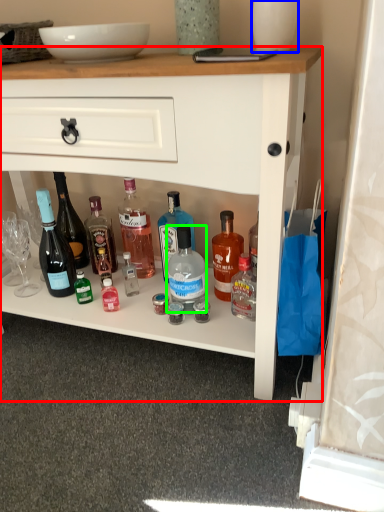
Question: Considering the real-world distances, which object is farthest from desk (highlighted by a red box)? glass vase (highlighted by a blue box) or bottle (highlighted by a green box)?

Choices:
 (A) glass vase
 (B) bottle

Answer: (A)